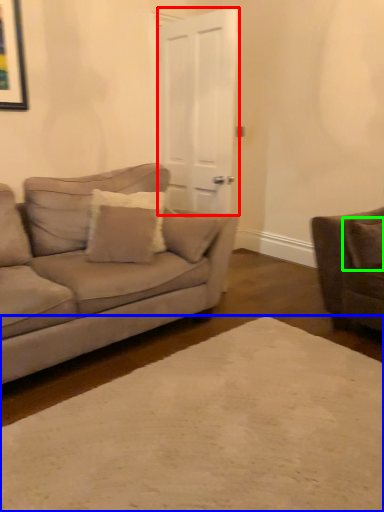
Question: Considering the real-world distances, which object is farthest from glass door (highlighted by a red box)? plain (highlighted by a blue box) or pillow (highlighted by a green box)?

Choices:
 (A) plain
 (B) pillow

Answer: (A)